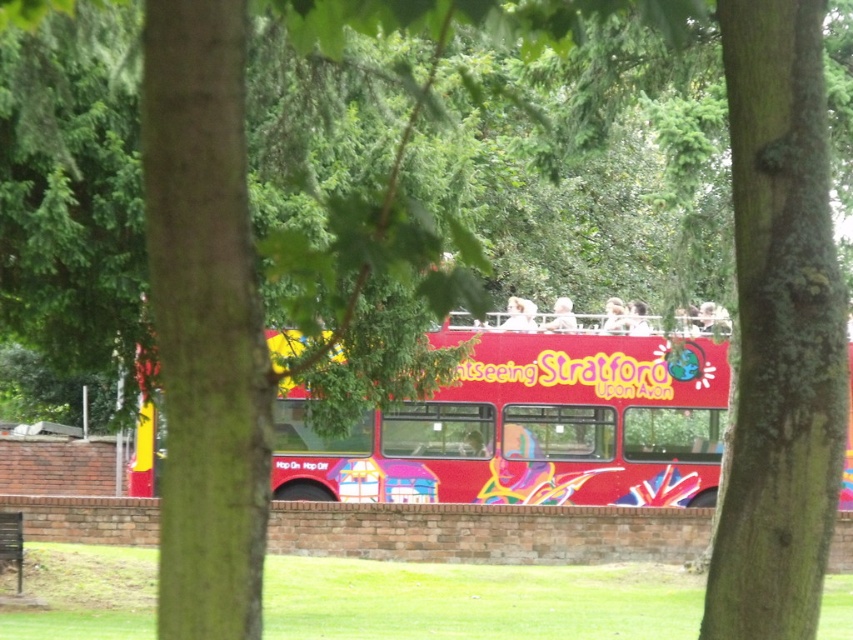
Question: Which point appears closest to the camera in this image?

Choices:
 (A) (672, 355)
 (B) (787, 294)

Answer: (B)

Question: From the image, what is the correct spatial relationship of green rough bark tree at center in relation to shiny red bus at center?

Choices:
 (A) right
 (B) left

Answer: (A)

Question: Which of the following is the closest to the observer?

Choices:
 (A) green rough bark tree at center
 (B) shiny red bus at center

Answer: (A)

Question: Does green rough bark tree at center have a smaller size compared to shiny red bus at center?

Choices:
 (A) no
 (B) yes

Answer: (B)

Question: Is green rough bark tree at center thinner than shiny red bus at center?

Choices:
 (A) yes
 (B) no

Answer: (A)